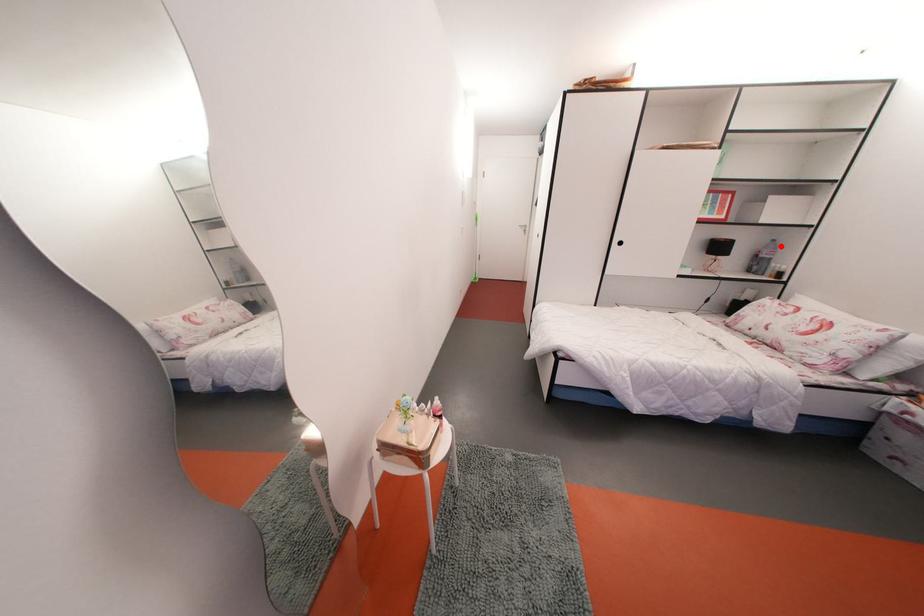
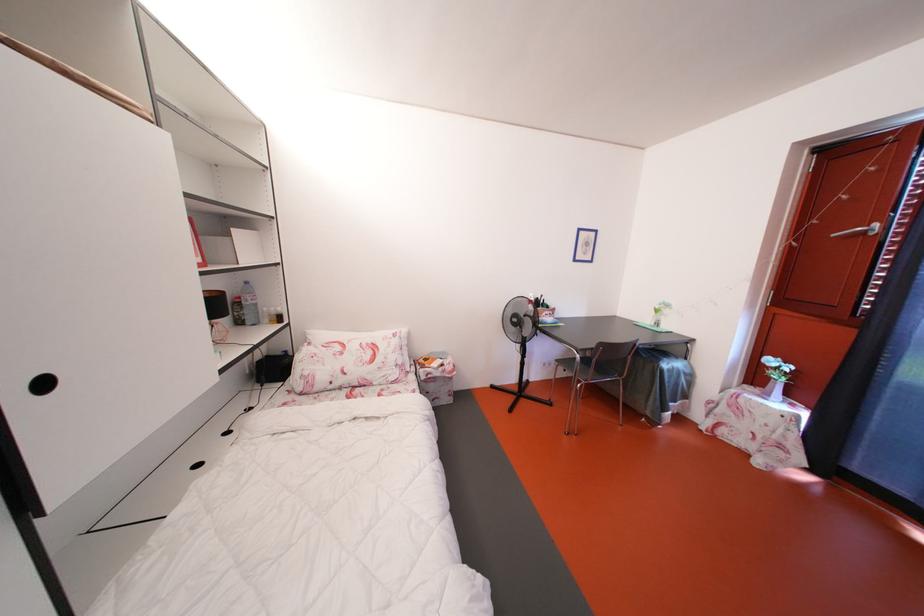
In the second image, find the point that corresponds to the highlighted location in the first image.

(253, 288)